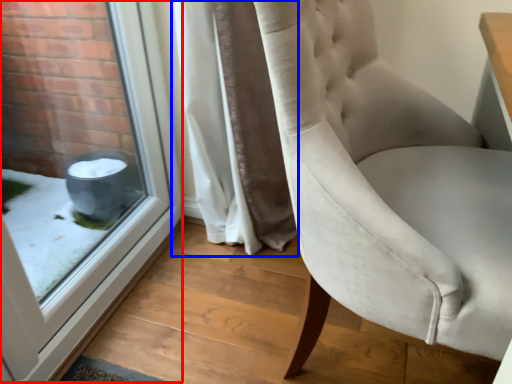
Question: Among these objects, which one is farthest to the camera, window (highlighted by a red box) or curtain (highlighted by a blue box)?

Choices:
 (A) window
 (B) curtain

Answer: (B)